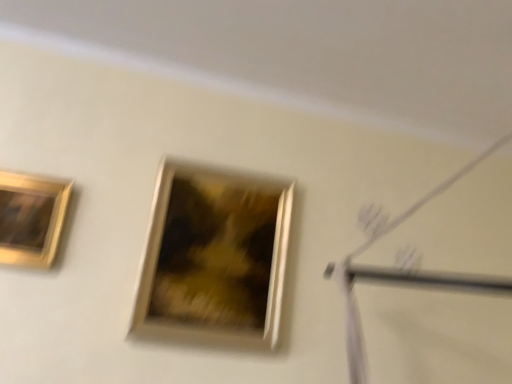
Question: Looking at their shapes, would you say gold metallic picture frame at upper left, which is the 1th picture frame in left-to-right order, is wider or thinner than gold metallic picture frame at center, arranged as the first picture frame when viewed from the right?

Choices:
 (A) thin
 (B) wide

Answer: (A)

Question: From a real-world perspective, is gold metallic picture frame at upper left, which is counted as the second picture frame, starting from the right, above or below gold metallic picture frame at center, arranged as the first picture frame when viewed from the right?

Choices:
 (A) above
 (B) below

Answer: (A)

Question: Based on their sizes in the image, would you say gold metallic picture frame at upper left, which is counted as the second picture frame, starting from the right, is bigger or smaller than gold metallic picture frame at center, arranged as the second picture frame when viewed from the left?

Choices:
 (A) small
 (B) big

Answer: (A)

Question: Is point (227, 208) closer or farther from the camera than point (18, 190)?

Choices:
 (A) closer
 (B) farther

Answer: (B)

Question: In terms of height, does gold metallic picture frame at center, arranged as the first picture frame when viewed from the right, look taller or shorter compared to gold metallic picture frame at upper left, which is the 1th picture frame in left-to-right order?

Choices:
 (A) short
 (B) tall

Answer: (B)

Question: Is gold metallic picture frame at center, arranged as the first picture frame when viewed from the right, inside or outside of gold metallic picture frame at upper left, which is the 1th picture frame in left-to-right order?

Choices:
 (A) inside
 (B) outside

Answer: (B)

Question: From the image's perspective, is gold metallic picture frame at center, arranged as the first picture frame when viewed from the right, above or below gold metallic picture frame at upper left, which is counted as the second picture frame, starting from the right?

Choices:
 (A) above
 (B) below

Answer: (B)